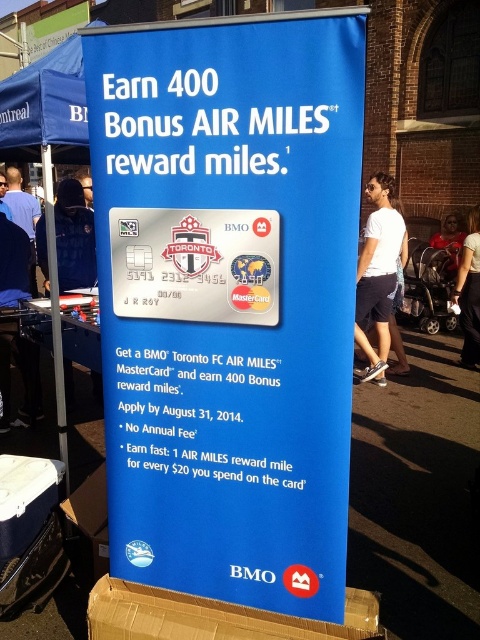
Question: Is blue fabric canopy at upper left positioned in front of black fabric at left?

Choices:
 (A) yes
 (B) no

Answer: (A)

Question: Which point is farther to the camera?

Choices:
 (A) (464, 300)
 (B) (230, 298)

Answer: (A)

Question: Which of the following is the closest to the observer?

Choices:
 (A) tap(456, 232)
 (B) tap(476, 208)
 (C) tap(41, 262)
 (D) tap(84, 184)

Answer: (C)

Question: Is blue paper sign at center thinner than blue fabric canopy at upper left?

Choices:
 (A) yes
 (B) no

Answer: (B)

Question: Based on their relative distances, which object is farther from the white cotton shirt at right?

Choices:
 (A) metallic silver card at center
 (B) matte black shirt at center
 (C) black fabric at left
 (D) blue fabric canopy at upper left

Answer: (A)

Question: Does blue paper sign at center have a lesser width compared to matte black jacket at left?

Choices:
 (A) yes
 (B) no

Answer: (B)